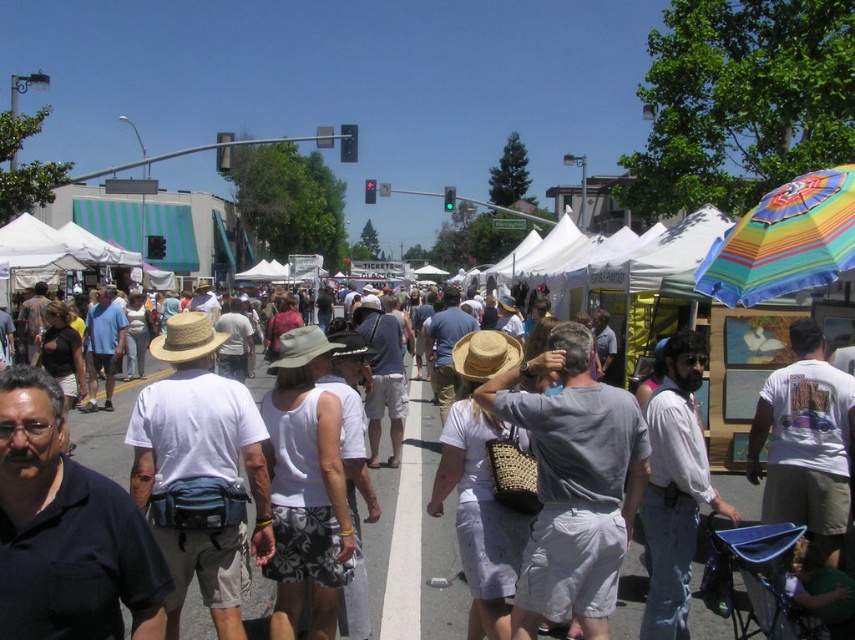
Consider the image. You are at a market and want to find the rainbow striped fabric umbrella at upper right. Which direction should you move from the matte white tent at center to locate it?

The matte white tent at center is positioned on the left side of the rainbow striped fabric umbrella at upper right, so you should move to the right from the matte white tent at center to find the rainbow striped fabric umbrella at upper right.

You are a customer at the market and want to find a shaded area. You see the matte white tent at center and the rainbow striped fabric umbrella at upper right. Which object is closer to the ground?

The matte white tent at center is closer to the ground because it is below the rainbow striped fabric umbrella at upper right.